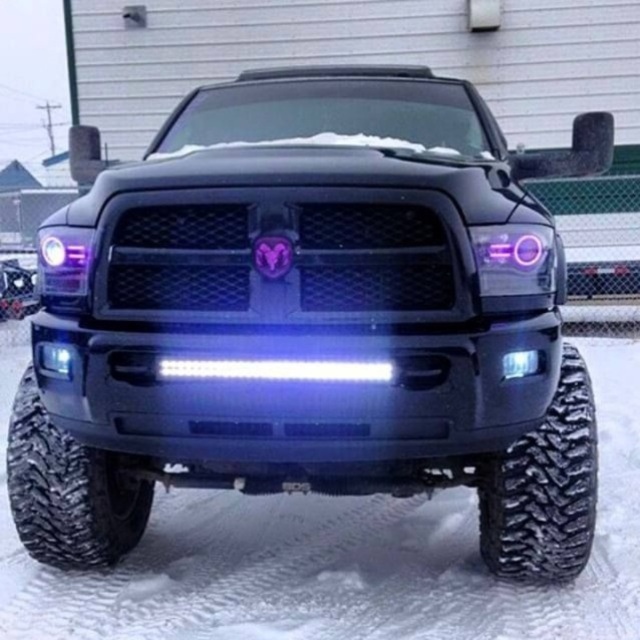
You are a photographer setting up a shot of the black Ram pickup truck in the snow. You need to ensure that both the black textured tire at lower right and the black rubber tire at lower left are visible in the frame. Which tire should you focus on to capture the larger one?

The black rubber tire at lower left is larger, so you should focus on it to capture the larger one.

You are a mechanic inspecting the tires of the black Ram pickup truck in the winter scene. You notice two tires on the lower part of the truck. Which tire has a smaller width between the black textured tire at lower right and the black rubber tire at lower left?

The black textured tire at lower right has a smaller width compared to the black rubber tire at lower left, as it is thinner.

You are a delivery driver who needs to park your black Ram pickup truck in a tight space. The parking spot is only 12 feet long. The truck has a black textured tire at lower right. Can you safely park the truck in this spot without hitting the camera that is 11.14 feet away from the tire?

The black textured tire at lower right and the camera are 11.14 feet apart. Since the parking spot is 12 feet long, which is slightly longer than the distance between the tire and the camera, you can safely park the truck in the spot without hitting the camera.